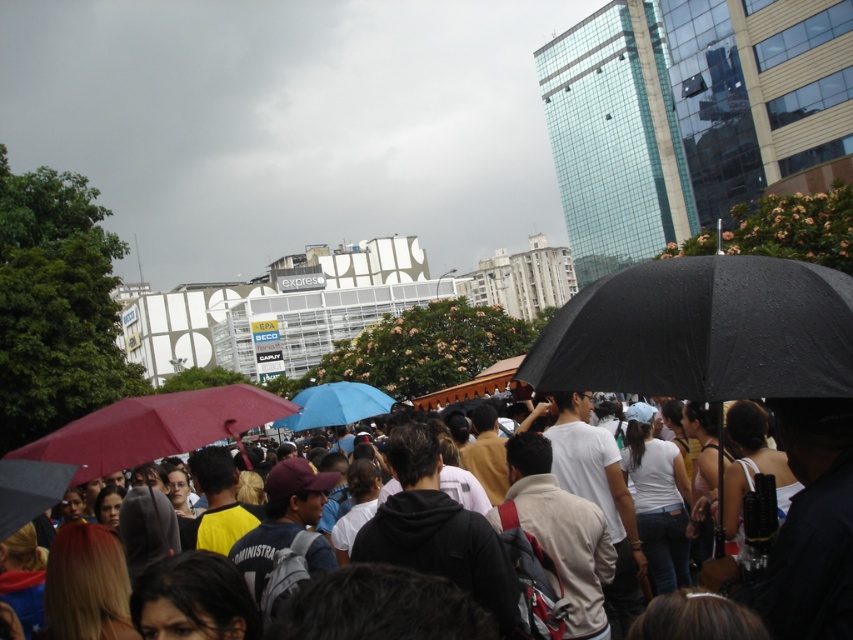
You are standing in the crowded outdoor scene and want to locate the black matte umbrella at center and the matte red umbrella at lower left. Which one is positioned to the right of the other?

The black matte umbrella at center is positioned to the right of the matte red umbrella at lower left.

You are a photographer standing at the camera position in the scene. You want to capture a closeup shot of the black matte umbrella at center. Considering the distance, is it feasible to take the photo without moving closer?

The black matte umbrella at center is 23.36 meters away from camera, so it might be challenging to capture a clear closeup without moving closer or using a telephoto lens.